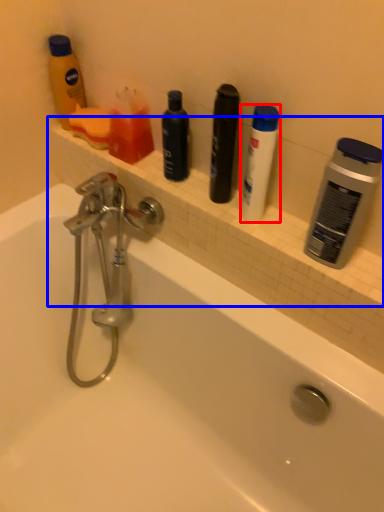
Question: Which of the following is the farthest to the observer, toiletry (highlighted by a red box) or ledge (highlighted by a blue box)?

Choices:
 (A) toiletry
 (B) ledge

Answer: (B)